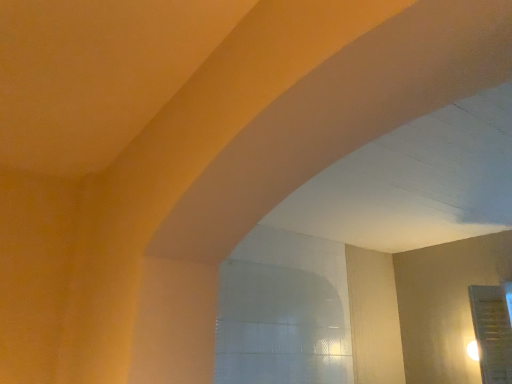
What is the approximate height of clear glass window at center?

clear glass window at center is 21.34 inches in height.

What do you see at coordinates (279, 327) in the screenshot? I see `clear glass window at center` at bounding box center [279, 327].

This screenshot has height=384, width=512. I want to click on clear glass window at center, so click(279, 327).

Measure the distance between transparent glass door at lower right and camera.

transparent glass door at lower right and camera are 2.54 meters apart.

The image size is (512, 384). What do you see at coordinates (492, 333) in the screenshot? I see `transparent glass door at lower right` at bounding box center [492, 333].

Locate an element on the screen. transparent glass door at lower right is located at coordinates (492, 333).

I want to click on clear glass window at center, so click(279, 327).

Is transparent glass door at lower right to the left of clear glass window at center from the viewer's perspective?

No, transparent glass door at lower right is not to the left of clear glass window at center.

Which object is further away from the camera taking this photo, transparent glass door at lower right or clear glass window at center?

transparent glass door at lower right is behind.

Is point (484, 363) closer or farther from the camera than point (301, 287)?

Clearly, point (484, 363) is closer to the camera than point (301, 287).

Looking at this image, from the image's perspective, which is below, transparent glass door at lower right or clear glass window at center?

transparent glass door at lower right.

From a real-world perspective, which object stands above the other?

transparent glass door at lower right, from a real-world perspective.

In terms of width, does transparent glass door at lower right look wider or thinner when compared to clear glass window at center?

In the image, transparent glass door at lower right appears to be more narrow than clear glass window at center.

In terms of height, does transparent glass door at lower right look taller or shorter compared to clear glass window at center?

In the image, transparent glass door at lower right appears to be taller than clear glass window at center.

Is transparent glass door at lower right bigger or smaller than clear glass window at center?

transparent glass door at lower right is bigger than clear glass window at center.

Is transparent glass door at lower right not within clear glass window at center?

Yes, transparent glass door at lower right is outside of clear glass window at center.

Is transparent glass door at lower right positioned far away from clear glass window at center?

That's right, there is a large distance between transparent glass door at lower right and clear glass window at center.

Is transparent glass door at lower right positioned with its back to clear glass window at center?

No, transparent glass door at lower right is not facing away from clear glass window at center.

Can you tell me how much transparent glass door at lower right and clear glass window at center differ in facing direction?

They differ by 179 degrees in their facing directions.

Locate an element on the screen. The width and height of the screenshot is (512, 384). window on the left of the transparent glass door at lower right is located at coordinates (279, 327).

Is clear glass window at center to the left or to the right of transparent glass door at lower right in the image?

Clearly, clear glass window at center is on the left of transparent glass door at lower right in the image.

Is clear glass window at center positioned before transparent glass door at lower right?

Yes, it is in front of transparent glass door at lower right.

Is point (232, 382) closer to camera compared to point (499, 367)?

Yes, point (232, 382) is in front of point (499, 367).

From the image's perspective, is clear glass window at center positioned above or below transparent glass door at lower right?

From the image's perspective, clear glass window at center appears above transparent glass door at lower right.

From a real-world perspective, which is physically above, clear glass window at center or transparent glass door at lower right?

transparent glass door at lower right, from a real-world perspective.

Considering the sizes of clear glass window at center and transparent glass door at lower right in the image, is clear glass window at center wider or thinner than transparent glass door at lower right?

Clearly, clear glass window at center has more width compared to transparent glass door at lower right.

In terms of height, does clear glass window at center look taller or shorter compared to transparent glass door at lower right?

Clearly, clear glass window at center is shorter compared to transparent glass door at lower right.

Which of these two, clear glass window at center or transparent glass door at lower right, is smaller?

Smaller between the two is clear glass window at center.

Is clear glass window at center inside the boundaries of transparent glass door at lower right, or outside?

The correct answer is: outside.

Would you say clear glass window at center is a long distance from transparent glass door at lower right?

clear glass window at center is far away from transparent glass door at lower right.

Is clear glass window at center oriented away from transparent glass door at lower right?

No, clear glass window at center is not facing the opposite direction of transparent glass door at lower right.

In order to click on window directly beneath the transparent glass door at lower right (from a real-world perspective) in this screenshot , I will do `click(279, 327)`.

This screenshot has width=512, height=384. In order to click on window on the left of transparent glass door at lower right in this screenshot , I will do `click(279, 327)`.

What are the coordinates of `window above the transparent glass door at lower right (from the image's perspective)` in the screenshot? It's located at (279, 327).